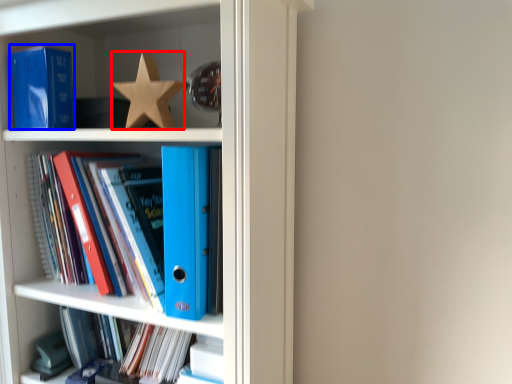
Question: Among these objects, which one is farthest to the camera, star (highlighted by a red box) or paperback book (highlighted by a blue box)?

Choices:
 (A) star
 (B) paperback book

Answer: (B)